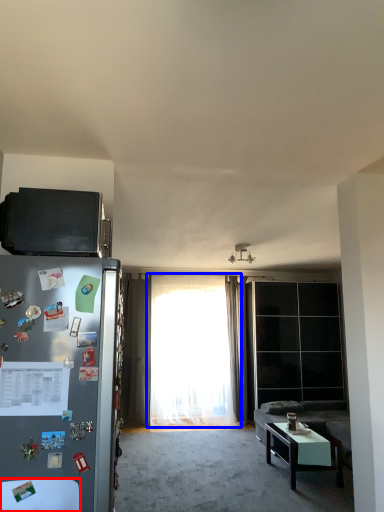
Question: Which object appears farthest to the camera in this image, table (highlighted by a red box) or curtain (highlighted by a blue box)?

Choices:
 (A) table
 (B) curtain

Answer: (B)